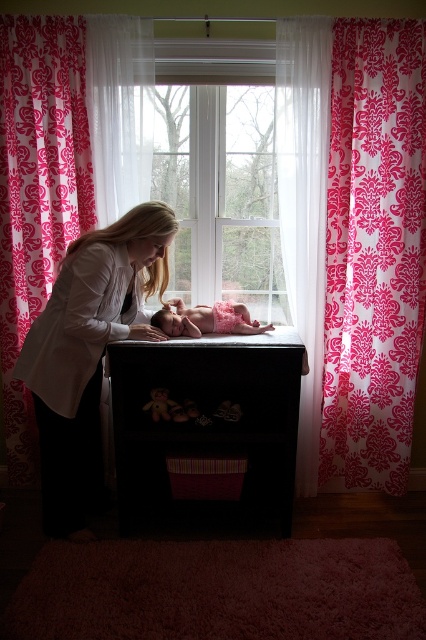
Is point (97, 433) positioned behind point (224, 332)?

Yes, it is.

Does matte white shirt at center appear on the right side of pink satin dress at center?

In fact, matte white shirt at center is to the left of pink satin dress at center.

I want to click on matte white shirt at center, so click(88, 353).

Identify the location of matte white shirt at center. (88, 353).

Is point (376, 444) positioned after point (195, 308)?

Yes, point (376, 444) is behind point (195, 308).

Between pink damask curtain at right and pink satin dress at center, which one is positioned lower?

Positioned lower is pink satin dress at center.

Describe the element at coordinates (374, 252) in the screenshot. This screenshot has height=640, width=426. I see `pink damask curtain at right` at that location.

Where is `pink damask curtain at right`? pink damask curtain at right is located at coordinates (374, 252).

How far apart are black matte changing table at center and matte white shirt at center?

A distance of 14.76 inches exists between black matte changing table at center and matte white shirt at center.

Does point (224, 449) lie behind point (83, 483)?

No, (224, 449) is closer to viewer.

The width and height of the screenshot is (426, 640). In order to click on black matte changing table at center in this screenshot , I will do pos(207,424).